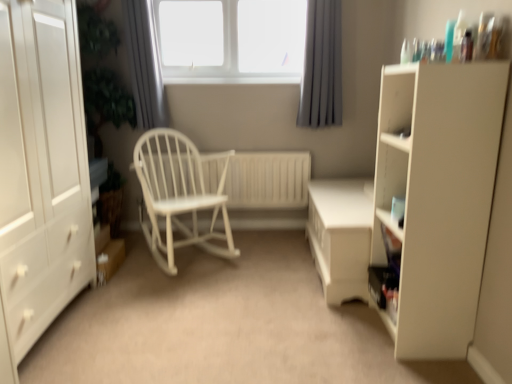
Find the location of `white wood rocking chair at center`. white wood rocking chair at center is located at coordinates (178, 194).

Locate an element on the screen. This screenshot has width=512, height=384. white wood window sill at upper center is located at coordinates (234, 80).

Image resolution: width=512 pixels, height=384 pixels. What are the coordinates of `white matte cabinet at left` in the screenshot? It's located at (41, 170).

Describe the element at coordinates (231, 40) in the screenshot. The height and width of the screenshot is (384, 512). I see `white plastic window at upper center` at that location.

The image size is (512, 384). What do you see at coordinates (322, 66) in the screenshot? I see `gray fabric curtain at upper center, the 2th curtain positioned from the left` at bounding box center [322, 66].

Image resolution: width=512 pixels, height=384 pixels. Find the location of `gray fabric curtain at upper center, the 2th curtain positioned from the left`. gray fabric curtain at upper center, the 2th curtain positioned from the left is located at coordinates (322, 66).

Locate an element on the screen. The image size is (512, 384). white wood rocking chair at center is located at coordinates (178, 194).

From the image's perspective, which is above, gray fabric curtain at upper center, the 2th curtain positioned from the left, or white wooden radiator at center?

gray fabric curtain at upper center, the 2th curtain positioned from the left, is shown above in the image.

Which object is wider, gray fabric curtain at upper center, the 2th curtain positioned from the left, or white wooden radiator at center?

gray fabric curtain at upper center, the 2th curtain positioned from the left.

Could you tell me if gray fabric curtain at upper center, the 2th curtain positioned from the left, is turned towards white wooden radiator at center?

No, gray fabric curtain at upper center, the 2th curtain positioned from the left, does not turn towards white wooden radiator at center.

Which is closer, (x=333, y=106) or (x=225, y=187)?

Point (x=333, y=106) appears to be closer to the viewer than point (x=225, y=187).

Does white wood window sill at upper center have a greater height compared to white matte cabinet at left?

No, white wood window sill at upper center is not taller than white matte cabinet at left.

Does white wood window sill at upper center lie behind white matte cabinet at left?

Yes, the depth of white wood window sill at upper center is greater than that of white matte cabinet at left.

Between white wood window sill at upper center and white matte cabinet at left, which one has larger width?

white matte cabinet at left.

How many degrees apart are the facing directions of white wood window sill at upper center and white matte cabinet at left?

89.1 degrees separate the facing orientations of white wood window sill at upper center and white matte cabinet at left.

This screenshot has height=384, width=512. I want to click on curtain that is the 1st object located in front of the white wooden radiator at center, so click(322, 66).

Does point (306, 178) appear closer or farther from the camera than point (335, 101)?

Point (306, 178) is farther from the camera than point (335, 101).

Is white wooden radiator at center looking in the opposite direction of gray fabric curtain at upper center, placed as the first curtain when sorted from right to left?

No, white wooden radiator at center's orientation is not away from gray fabric curtain at upper center, placed as the first curtain when sorted from right to left.

Based on the photo, from the image's perspective, which one is positioned higher, white wooden radiator at center or gray fabric curtain at upper center, the 2th curtain positioned from the left?

gray fabric curtain at upper center, the 2th curtain positioned from the left, is shown above in the image.

Is white wood rocking chair at center positioned beyond the bounds of white wooden radiator at center?

Absolutely, white wood rocking chair at center is external to white wooden radiator at center.

Which of these two, white wood rocking chair at center or white wooden radiator at center, is thinner?

white wooden radiator at center.

Looking at this image, visually, is white wood rocking chair at center positioned to the left or to the right of white wooden radiator at center?

Based on their positions, white wood rocking chair at center is located to the left of white wooden radiator at center.

Considering the relative positions of white wood rocking chair at center and white wooden radiator at center in the image provided, is white wood rocking chair at center behind white wooden radiator at center?

No.

From the image's perspective, is white plastic window at upper center located above or below white wooden radiator at center?

white plastic window at upper center is situated higher than white wooden radiator at center in the image.

From a real-world perspective, who is located higher, white plastic window at upper center or white wooden radiator at center?

white plastic window at upper center is physically above.

What's the angular difference between white plastic window at upper center and white wooden radiator at center's facing directions?

Answer: The facing directions of white plastic window at upper center and white wooden radiator at center are 1.32 degrees apart.

Which point is more distant from viewer, (303, 22) or (240, 188)?

The point (240, 188) is more distant.

Could you tell me if white wood rocking chair at center is facing white wood window sill at upper center?

No.

Is white wood rocking chair at center located outside white wood window sill at upper center?

white wood rocking chair at center lies outside white wood window sill at upper center's area.

Identify the location of window sill behind the white wood rocking chair at center. (234, 80).

Does white wood rocking chair at center have a greater width compared to white wood window sill at upper center?

Indeed, white wood rocking chair at center has a greater width compared to white wood window sill at upper center.

The height and width of the screenshot is (384, 512). Find the location of `table below the white wooden radiator at center (from a real-world perspective)`. table below the white wooden radiator at center (from a real-world perspective) is located at coordinates (341, 236).

Can you tell me how much white wooden radiator at center and white glossy table at center differ in facing direction?

The angular difference between white wooden radiator at center and white glossy table at center is 90.7 degrees.

How far apart are white wooden radiator at center and white glossy table at center?

white wooden radiator at center and white glossy table at center are 24.46 inches apart from each other.

From the image's perspective, who appears lower, white wooden radiator at center or white glossy table at center?

white glossy table at center appears lower in the image.

This screenshot has width=512, height=384. Find the location of `curtain on the right of the white wooden radiator at center`. curtain on the right of the white wooden radiator at center is located at coordinates (322, 66).

This screenshot has width=512, height=384. Find the location of `cabinetry beneath the white wood window sill at upper center (from a real-world perspective)`. cabinetry beneath the white wood window sill at upper center (from a real-world perspective) is located at coordinates tap(41, 170).

Considering their positions, is gray fabric curtain at upper center, the 2th curtain viewed from the right, positioned closer to white glossy table at center than white wood rocking chair at center?

white wood rocking chair at center.

Based on their spatial positions, is white wood rocking chair at center or white wooden radiator at center further from white matte cabinet at left?

white wooden radiator at center lies further to white matte cabinet at left than the other object.

From the image, which object appears to be nearer to white glossy table at center, white wood window sill at upper center or white matte cabinet at left?

white wood window sill at upper center is closer to white glossy table at center.

From the image, which object appears to be nearer to gray fabric curtain at upper center, placed as the first curtain when sorted from right to left, white plastic window at upper center or gray fabric curtain at upper center, the 1th curtain viewed from the left?

white plastic window at upper center is positioned closer to the anchor gray fabric curtain at upper center, placed as the first curtain when sorted from right to left.

Based on their spatial positions, is white wood window sill at upper center or gray fabric curtain at upper center, the 2th curtain positioned from the left, closer to white plastic window at upper center?

white wood window sill at upper center is closer to white plastic window at upper center.

Considering their positions, is white wood rocking chair at center positioned closer to white wood window sill at upper center than white glossy table at center?

Based on the image, white glossy table at center appears to be nearer to white wood window sill at upper center.

Which object lies nearer to the anchor point white wood window sill at upper center, white matte cabinet at left or white glossy table at center?

The object closer to white wood window sill at upper center is white glossy table at center.

When comparing their distances from white plastic window at upper center, does white wood rocking chair at center or white glossy table at center seem closer?

white glossy table at center lies closer to white plastic window at upper center than the other object.

Image resolution: width=512 pixels, height=384 pixels. I want to click on chair between white matte cabinet at left and matte white cupboard at right, so click(178, 194).

The image size is (512, 384). I want to click on chair between matte white cupboard at right and white wooden radiator at center along the z-axis, so click(x=178, y=194).

This screenshot has height=384, width=512. What are the coordinates of `table between white wood rocking chair at center and matte white cupboard at right from left to right` in the screenshot? It's located at (341, 236).

Where is `table that lies between gray fabric curtain at upper center, placed as the first curtain when sorted from right to left, and white wood rocking chair at center from top to bottom`? Image resolution: width=512 pixels, height=384 pixels. table that lies between gray fabric curtain at upper center, placed as the first curtain when sorted from right to left, and white wood rocking chair at center from top to bottom is located at coordinates (341, 236).